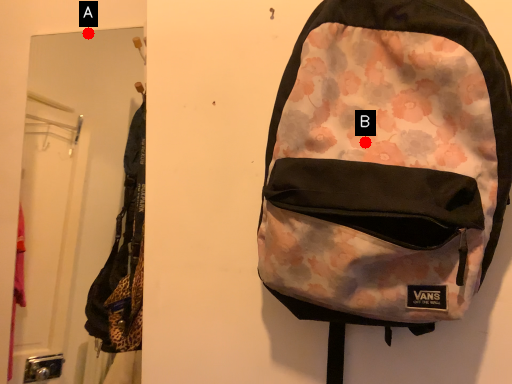
Question: Two points are circled on the image, labeled by A and B beside each circle. Among these points, which one is farthest from the camera?

Choices:
 (A) A is further
 (B) B is further

Answer: (A)